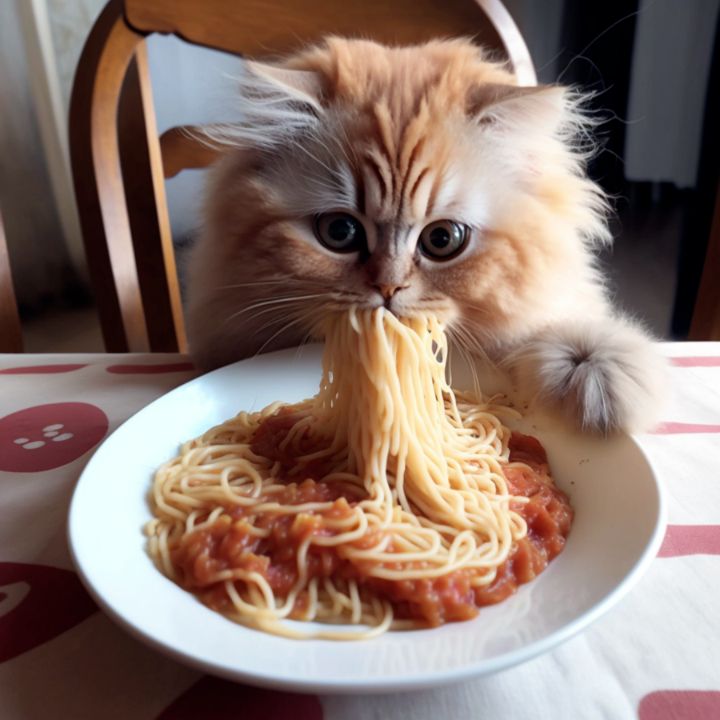
Where is `bowl rim`? Image resolution: width=720 pixels, height=720 pixels. bowl rim is located at coordinates (643, 564).